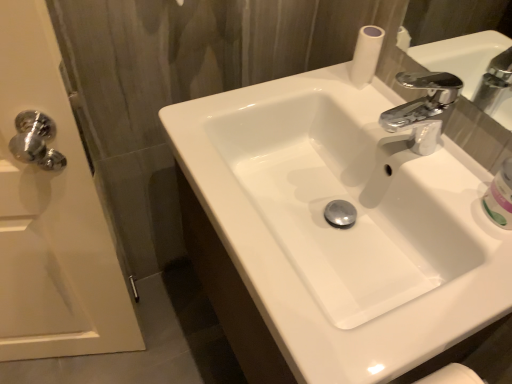
What do you see at coordinates (51, 212) in the screenshot? The image size is (512, 384). I see `white glossy door handle at left` at bounding box center [51, 212].

You are a GUI agent. You are given a task and a screenshot of the screen. Output one action in this format:
    pyautogui.click(x=<x>, y=<y>)
    Task: Click on the white glossy sink at center
    This screenshot has width=512, height=384.
    Given the screenshot: What is the action you would take?
    pyautogui.click(x=333, y=231)

Identify the location of white glossy mouthwash at right. This screenshot has height=384, width=512. (500, 196).

Which is in front, white glossy mouthwash at right or white glossy sink at center?

white glossy sink at center is more forward.

From the image's perspective, is white glossy mouthwash at right positioned above or below white glossy sink at center?

Clearly, from the image's perspective, white glossy mouthwash at right is above white glossy sink at center.

Is white glossy mouthwash at right located outside white glossy sink at center?

Yes, white glossy mouthwash at right is located beyond the bounds of white glossy sink at center.

This screenshot has width=512, height=384. Identify the location of screen door that appears below the white glossy sink at center (from a real-world perspective). (51, 212).

Is white glossy door handle at left smaller than white glossy sink at center?

Indeed, white glossy door handle at left has a smaller size compared to white glossy sink at center.

Is white glossy sink at center inside white glossy door handle at left?

Definitely not — white glossy sink at center is not inside white glossy door handle at left.

From a real-world perspective, is white glossy door handle at left over white glossy sink at center?

No, from a real-world perspective, white glossy door handle at left is not above white glossy sink at center.

From the image's perspective, which object appears higher, white glossy sink at center or white glossy mouthwash at right?

white glossy mouthwash at right.

In the image, is white glossy sink at center on the left side or the right side of white glossy mouthwash at right?

white glossy sink at center is positioned on white glossy mouthwash at right's left side.

Is white glossy mouthwash at right a part of white glossy sink at center?

No, white glossy sink at center does not contain white glossy mouthwash at right.

Is white glossy sink at center placed right next to white glossy mouthwash at right?

There is a gap between white glossy sink at center and white glossy mouthwash at right.

Is white glossy sink at center positioned beyond the bounds of white glossy door handle at left?

Yes, white glossy sink at center is located beyond the bounds of white glossy door handle at left.

Can you confirm if white glossy sink at center is thinner than white glossy door handle at left?

No.

Based on their sizes in the image, would you say white glossy sink at center is bigger or smaller than white glossy door handle at left?

white glossy sink at center is bigger than white glossy door handle at left.

From the image's perspective, is white glossy mouthwash at right located above or below white glossy door handle at left?

From the image's perspective, white glossy mouthwash at right appears above white glossy door handle at left.

Which object is closer to the camera, white glossy mouthwash at right or white glossy door handle at left?

Positioned in front is white glossy door handle at left.

Does point (482, 199) come in front of point (25, 71)?

No.

Can you see white glossy door handle at left touching white glossy mouthwash at right?

They are not placed beside each other.

In the scene shown: Does white glossy door handle at left lie in front of white glossy mouthwash at right?

Answer: Yes, white glossy door handle at left is closer to the camera.

Which object is positioned more to the left, white glossy door handle at left or white glossy mouthwash at right?

white glossy door handle at left.

Consider the image. Is white glossy door handle at left not inside white glossy mouthwash at right?

Yes, white glossy door handle at left is outside of white glossy mouthwash at right.

The image size is (512, 384). What are the coordinates of `mouthwash behind the white glossy sink at center` in the screenshot? It's located at (500, 196).

Where is `sink located above the white glossy door handle at left (from a real-world perspective)`? This screenshot has height=384, width=512. sink located above the white glossy door handle at left (from a real-world perspective) is located at coordinates (333, 231).

When comparing their distances from white glossy mouthwash at right, does white glossy sink at center or white glossy door handle at left seem closer?

white glossy sink at center lies closer to white glossy mouthwash at right than the other object.

Based on their spatial positions, is white glossy mouthwash at right or white glossy door handle at left further from white glossy sink at center?

white glossy door handle at left is further to white glossy sink at center.

From the image, which object appears to be nearer to white glossy door handle at left, white glossy sink at center or white glossy mouthwash at right?

white glossy sink at center is positioned closer to the anchor white glossy door handle at left.

From the picture: Considering their positions, is white glossy door handle at left positioned closer to white glossy sink at center than white glossy mouthwash at right?

Based on the image, white glossy mouthwash at right appears to be nearer to white glossy sink at center.

Looking at the image, which one is located further to white glossy door handle at left, white glossy mouthwash at right or white glossy sink at center?

Based on the image, white glossy mouthwash at right appears to be further to white glossy door handle at left.

Estimate the real-world distances between objects in this image. Which object is closer to white glossy mouthwash at right, white glossy door handle at left or white glossy sink at center?

white glossy sink at center is closer to white glossy mouthwash at right.

This screenshot has width=512, height=384. I want to click on sink between white glossy door handle at left and white glossy mouthwash at right from left to right, so click(333, 231).